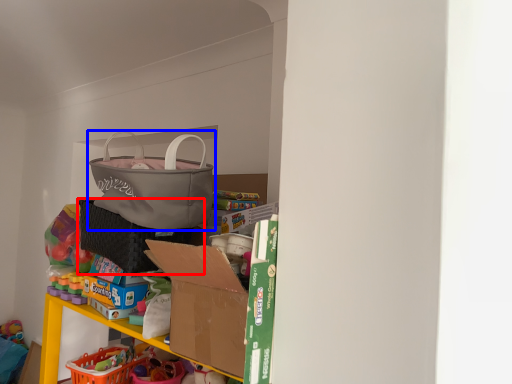
Question: Which object is closer to the camera taking this photo, laundry basket (highlighted by a red box) or handbag (highlighted by a blue box)?

Choices:
 (A) laundry basket
 (B) handbag

Answer: (B)